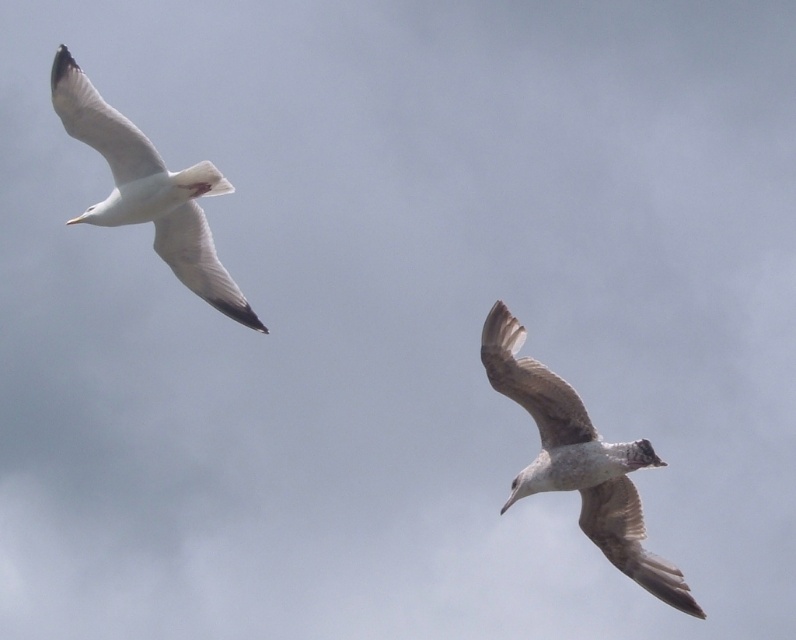
From the picture: You are standing at a point 79.73 meters away from the camera. You want to take a photo of the seagulls in the image. Is the point at coordinates point (572, 448) within your camera frame?

The point at coordinates point (572, 448) is 79.73 meters away from the camera, so if your current position is exactly at that point, you would be looking directly at the camera. Therefore, the point at coordinates point (572, 448) would be within your camera frame as it is the point from which you are taking the photo.

You are a birdwatcher observing two birds in the sky. You notice the light brown feathered bird at lower right and the white feathered bird at upper left. Which bird appears taller when viewed from your position?

The light brown feathered bird at lower right appears taller than the white feathered bird at upper left based on their relative positions and sizes in the image.

You are a birdwatcher trying to determine which point in the image is closer to you. Given the two points labeled as point (658, 577) and point (178, 195), which one is nearer based on the spatial information provided?

Point (658, 577) is closer to the viewer than point (178, 195) according to the spatial information provided.